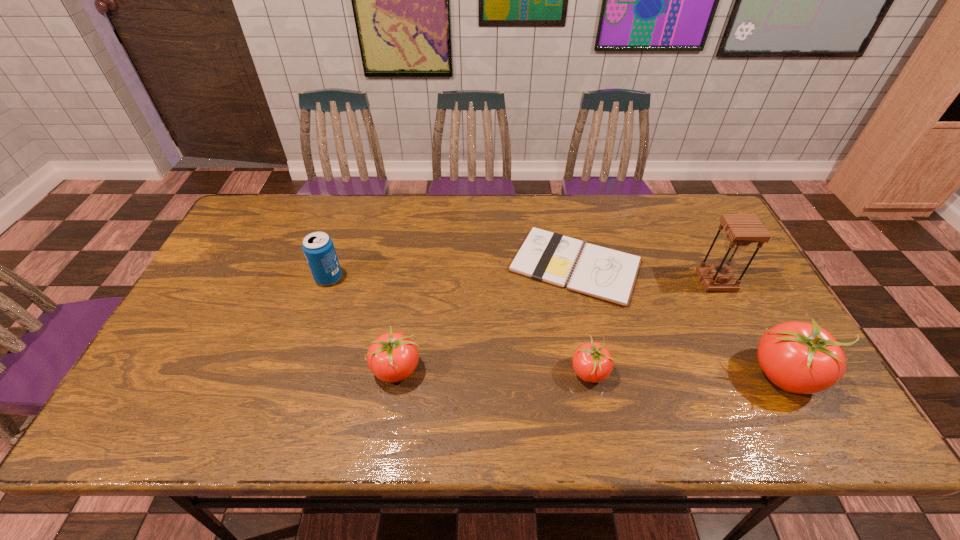
At what (x,y) coordinates should I click in order to perform the action: click on the fifth object from right to left. Please return your answer as a coordinate pair (x, y). This screenshot has height=540, width=960. Looking at the image, I should click on (392, 357).

You are a GUI agent. You are given a task and a screenshot of the screen. Output one action in this format:
    pyautogui.click(x=<x>, y=<y>)
    Task: Click on the third shortest object
    The image size is (960, 540).
    Given the screenshot: What is the action you would take?
    pyautogui.click(x=392, y=357)

The width and height of the screenshot is (960, 540). Identify the location of the second tomato from left to right. (592, 362).

You are a GUI agent. You are given a task and a screenshot of the screen. Output one action in this format:
    pyautogui.click(x=<x>, y=<y>)
    Task: Click on the shortest tomato
    This screenshot has height=540, width=960.
    Given the screenshot: What is the action you would take?
    pyautogui.click(x=592, y=362)

Find the location of `the tallest tomato`. the tallest tomato is located at coordinates (798, 357).

This screenshot has width=960, height=540. Identify the location of notepad. (607, 274).

This screenshot has width=960, height=540. Find the location of `the leftmost object`. the leftmost object is located at coordinates (318, 247).

The image size is (960, 540). What are the coordinates of `the tallest object` in the screenshot? It's located at (742, 229).

Find the location of a particular element. free region located 0.290m on the right of the second tallest tomato is located at coordinates (542, 369).

Find the location of a particular element. This screenshot has width=960, height=540. vacant point located on the left of the second shortest object is located at coordinates (444, 372).